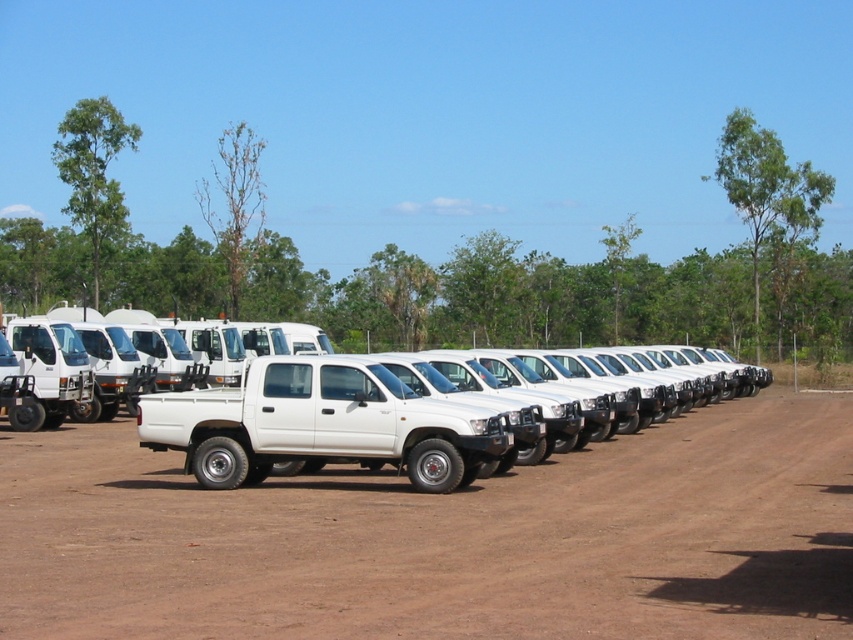
Who is positioned more to the right, brown dirt field at center or white matte pickup truck at center?

brown dirt field at center

Can you confirm if brown dirt field at center is bigger than white matte pickup truck at center?

Yes, brown dirt field at center is bigger than white matte pickup truck at center.

Does point (138, 506) come in front of point (281, 452)?

Yes.

Locate an element on the screen. brown dirt field at center is located at coordinates (444, 540).